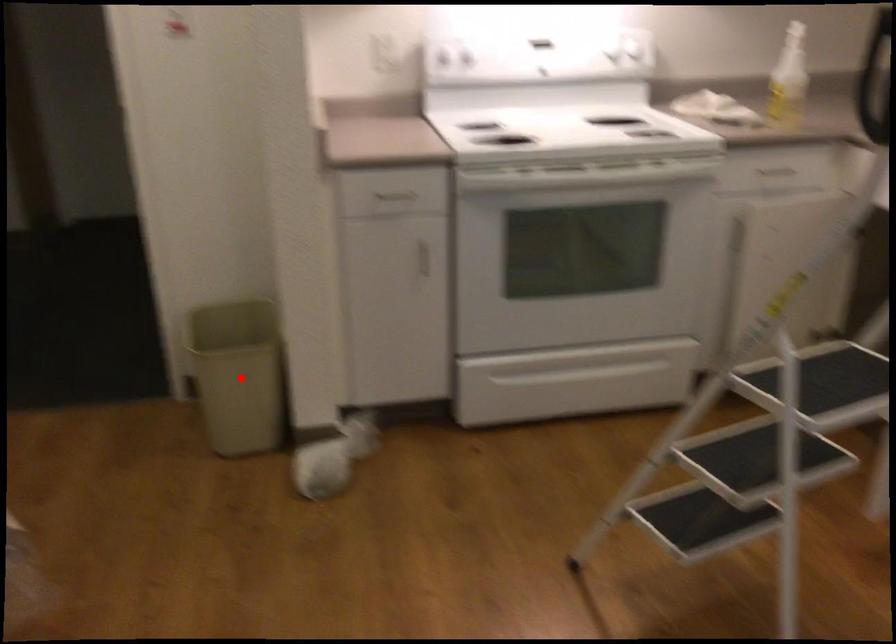
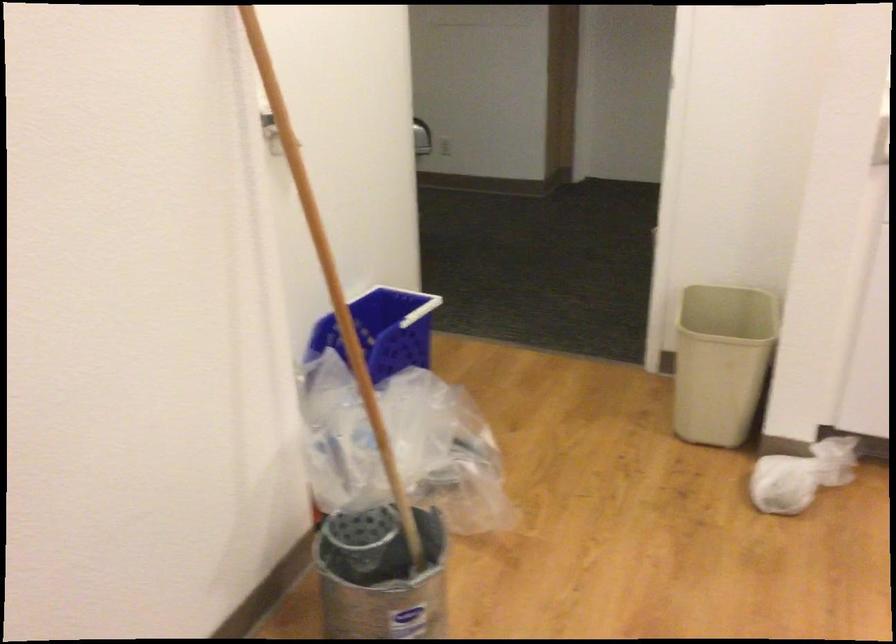
Find the pixel in the second image that matches the highlighted location in the first image.

(721, 362)